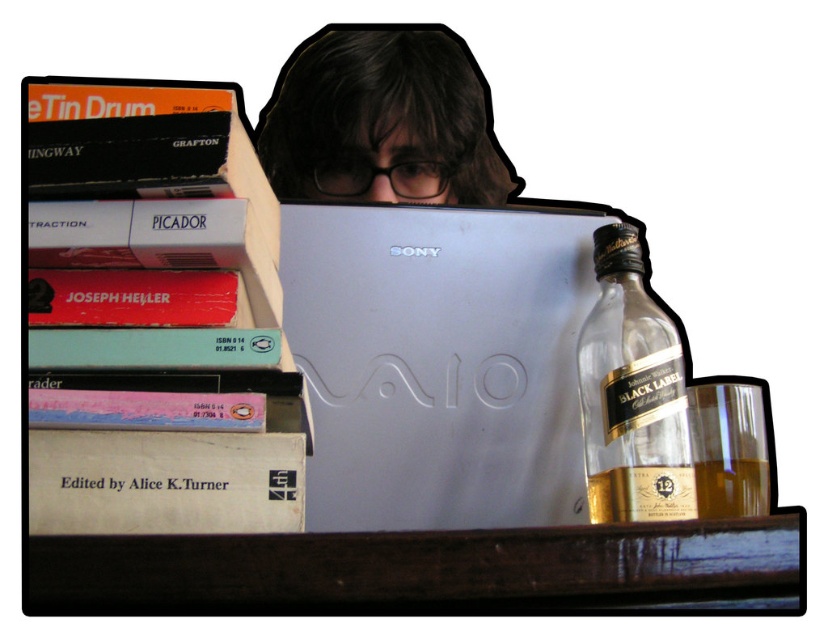
Where is the silver metallic laptop at center located in the image?

The silver metallic laptop at center is located at point (439, 362).

You are organizing a study session and need to place a large textbook on the desk. The textbook is too big to fit between the hardcover books at left and the brown wooden table at lower center. Where should you place it to ensure it doesn t block the view of the laptop?

Since the brown wooden table at lower center is behind the hardcover books at left, you should place the large textbook in front of the hardcover books at left to avoid blocking the view of the laptop.

You are a person sitting at the desk and want to reach for the silver metallic laptop at center and the brown wooden table at lower center. Which object is closer to you?

The silver metallic laptop at center is closer to you because it is further to the viewer than the brown wooden table at lower center.